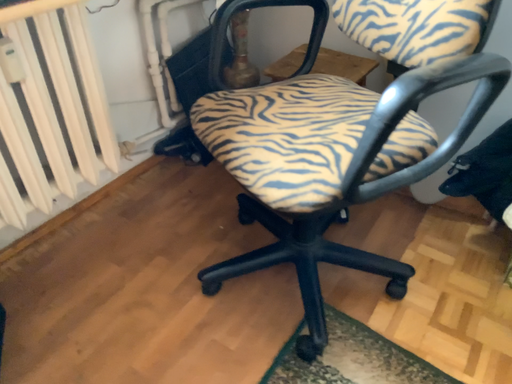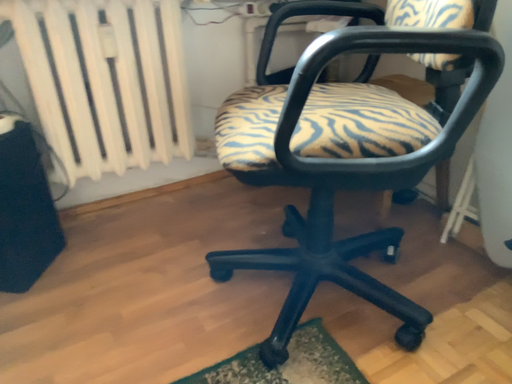
Question: Which way did the camera rotate in the video?

Choices:
 (A) rotated upward
 (B) rotated downward

Answer: (A)